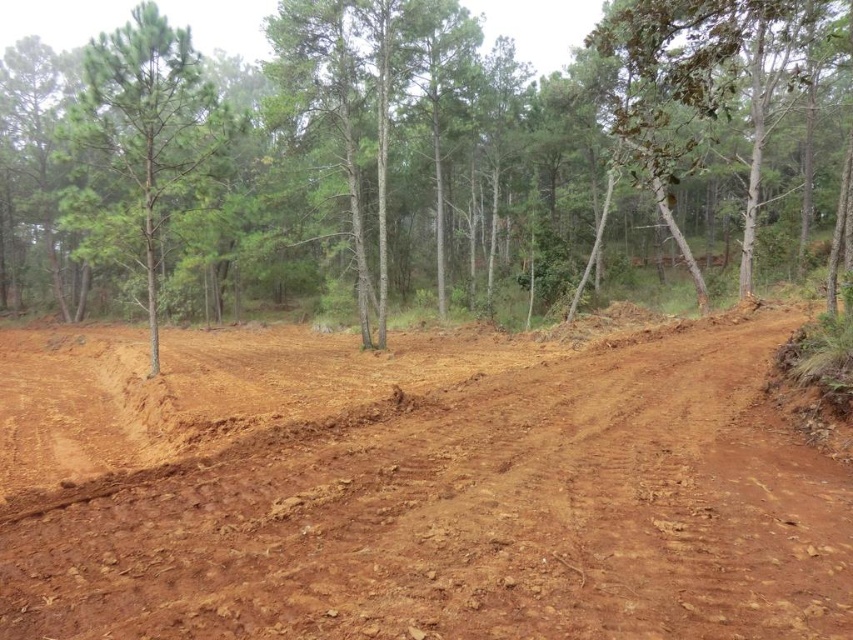
Who is lower down, brown clay dirt at center or green matte tree at left?

Positioned lower is brown clay dirt at center.

Who is more forward, (289, 490) or (144, 232)?

Point (289, 490) is more forward.

Between point (196, 552) and point (178, 88), which one is positioned behind?

The point (178, 88) is behind.

Find the location of `brown clay dirt at center`. brown clay dirt at center is located at coordinates (413, 488).

Can you confirm if green textured tree at upper left is positioned below green leafy tree at upper right?

Actually, green textured tree at upper left is above green leafy tree at upper right.

Is green textured tree at upper left wider than green leafy tree at upper right?

Yes.

Who is more distant from viewer, (x=235, y=65) or (x=634, y=134)?

The point (x=235, y=65) is more distant.

The height and width of the screenshot is (640, 853). Find the location of `green textured tree at upper left`. green textured tree at upper left is located at coordinates (413, 154).

Who is shorter, green textured tree at upper left or green matte tree at left?

With less height is green matte tree at left.

Consider the image. Is green textured tree at upper left bigger than green matte tree at left?

Yes, green textured tree at upper left is bigger than green matte tree at left.

Which is in front, point (363, 129) or point (149, 77)?

Point (149, 77) is more forward.

Locate an element on the screen. green textured tree at upper left is located at coordinates 413,154.